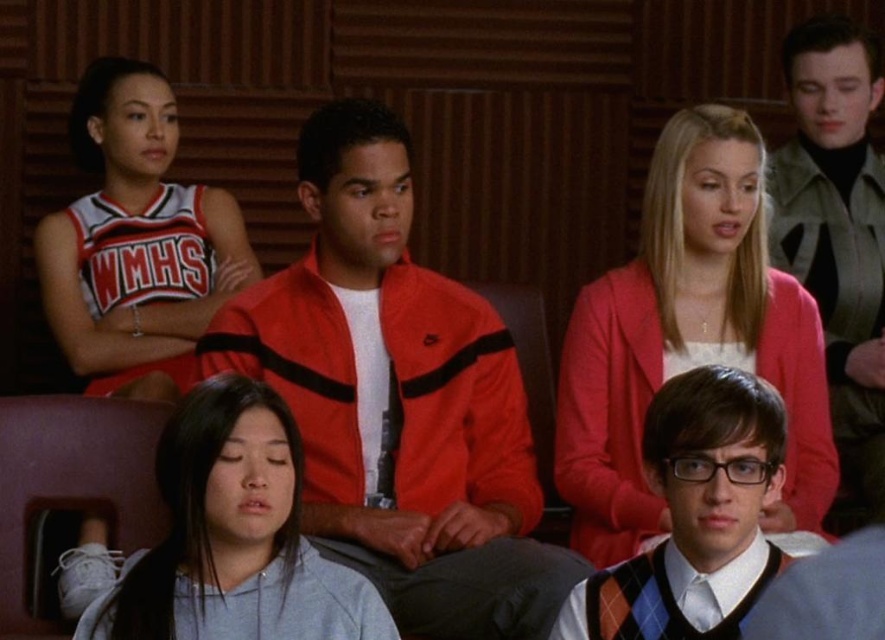
Based on the scene described, which object is taller between the pink cardigan at upper center and the gray cotton shirt at lower left?

The pink cardigan at upper center is taller than the gray cotton shirt at lower left according to the provided description.

Where is the matte red jacket at center located in the image?

The matte red jacket at center is located at point 0.625 on the x axis and 0.451 on the y axis.

In the classroom scene, there is a matte red jacket at center and a gray cotton shirt at lower left. Which clothing item is positioned to the right of the other?

The matte red jacket at center is to the right of the gray cotton shirt at lower left.